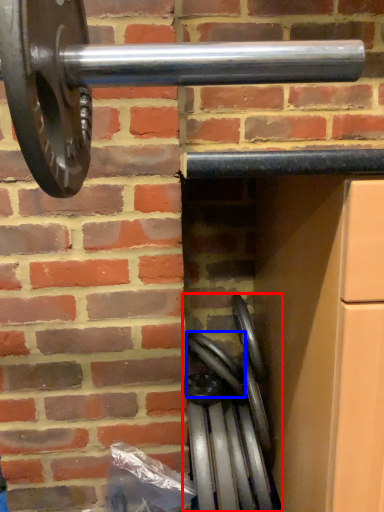
Question: Which of the following is the closest to the observer, wheel (highlighted by a red box) or wheel (highlighted by a blue box)?

Choices:
 (A) wheel
 (B) wheel

Answer: (A)